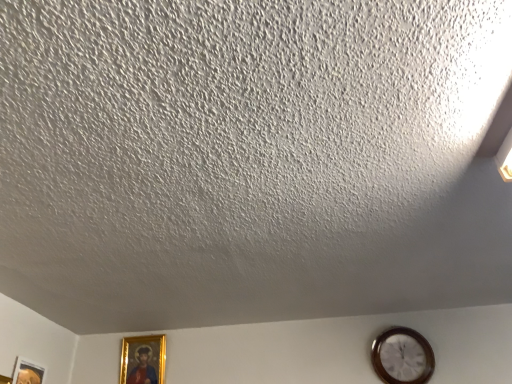
Question: Can you confirm if gold-framed picture at lower left, marked as the first picture frame in a right-to-left arrangement, is smaller than wooden wall clock at lower right?

Choices:
 (A) yes
 (B) no

Answer: (A)

Question: From a real-world perspective, does gold-framed picture at lower left, marked as the first picture frame in a right-to-left arrangement, sit lower than wooden wall clock at lower right?

Choices:
 (A) no
 (B) yes

Answer: (A)

Question: Is gold-framed picture at lower left, which appears as the 2th picture frame when viewed from the left, thinner than wooden wall clock at lower right?

Choices:
 (A) no
 (B) yes

Answer: (B)

Question: Is gold-framed picture at lower left, which is the 2th picture frame in front-to-back order, to the left of wooden wall clock at lower right from the viewer's perspective?

Choices:
 (A) yes
 (B) no

Answer: (A)

Question: Is gold-framed picture at lower left, the first picture frame viewed from the back, turned away from wooden wall clock at lower right?

Choices:
 (A) no
 (B) yes

Answer: (A)

Question: Can you confirm if gold-framed picture at lower left, marked as the first picture frame in a right-to-left arrangement, is bigger than wooden wall clock at lower right?

Choices:
 (A) no
 (B) yes

Answer: (A)

Question: Would you say wooden wall clock at lower right contains matte gold picture frame at lower left, the second picture frame when ordered from back to front?

Choices:
 (A) no
 (B) yes

Answer: (A)

Question: Is there a large distance between wooden wall clock at lower right and matte gold picture frame at lower left, which is the 1th picture frame in front-to-back order?

Choices:
 (A) yes
 (B) no

Answer: (A)

Question: Is wooden wall clock at lower right positioned with its back to matte gold picture frame at lower left, which is the 1th picture frame in front-to-back order?

Choices:
 (A) yes
 (B) no

Answer: (B)

Question: Is wooden wall clock at lower right shorter than matte gold picture frame at lower left, the second picture frame when ordered from back to front?

Choices:
 (A) yes
 (B) no

Answer: (A)

Question: Is wooden wall clock at lower right wider than matte gold picture frame at lower left, the 1th picture frame in the left-to-right sequence?

Choices:
 (A) yes
 (B) no

Answer: (A)

Question: Are wooden wall clock at lower right and matte gold picture frame at lower left, which is the 1th picture frame in front-to-back order, beside each other?

Choices:
 (A) yes
 (B) no

Answer: (B)

Question: Is matte gold picture frame at lower left, the second picture frame when ordered from back to front, wider than gold-framed picture at lower left, marked as the first picture frame in a right-to-left arrangement?

Choices:
 (A) no
 (B) yes

Answer: (A)